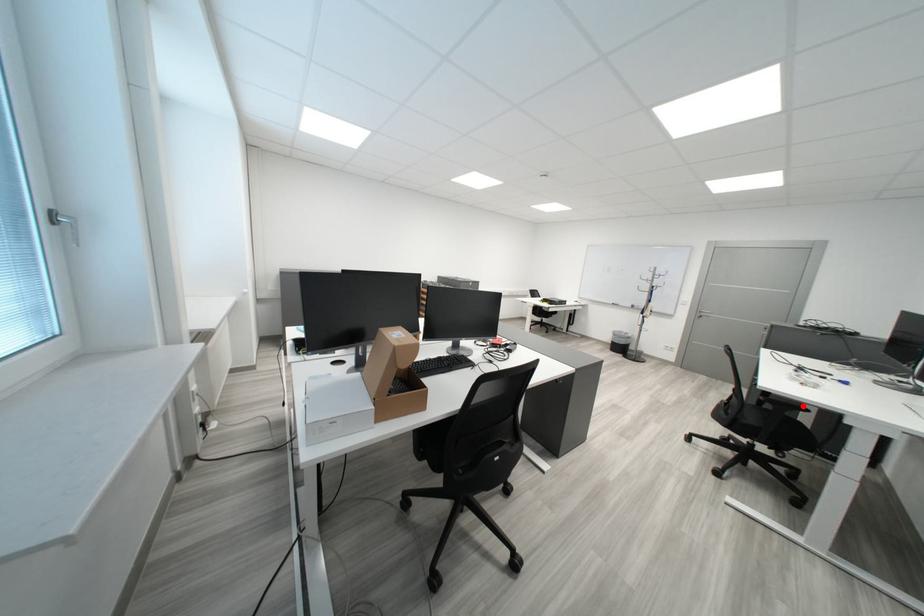
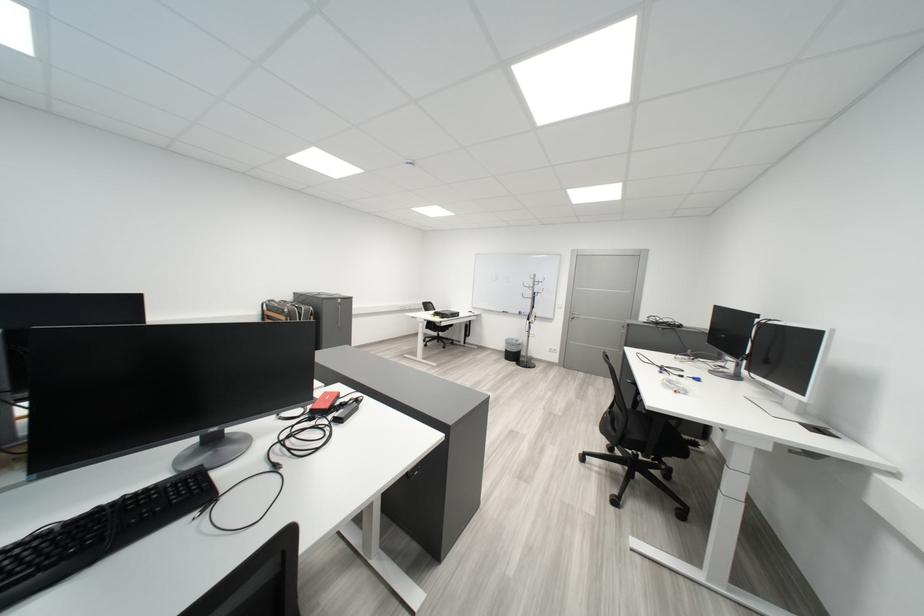
Question: I am providing you with two images of the same scene from different viewpoints. A red point is marked on the first image. Is the red point's position out of view in image 2?

Choices:
 (A) Yes
 (B) No

Answer: (A)